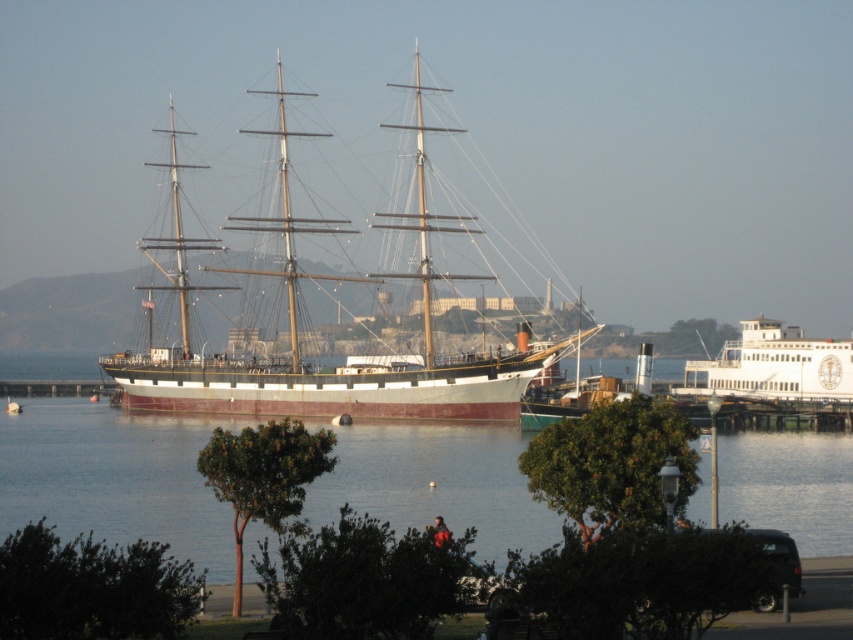
You are standing on the pier next to the historic building and want to take a photo of the rusty metal sailboat at center. If your camera has a maximum zoom range of 100 feet, can you capture the sailboat clearly without moving closer?

The rusty metal sailboat at center and camera are 410.88 feet apart, which exceeds the camera maximum zoom range of 100 feet. Therefore, you cannot capture the sailboat clearly without moving closer.

You are a sailor who wants to board the rusty metal sailboat at center from the pier. The clear water at center is between the pier and the sailboat. Can you step onto the sailboat directly from the pier without getting wet?

The clear water at center has a lesser height compared to the rusty metal sailboat at center, meaning the sailboat is higher than the water. Since the water is lower, you can step onto the sailboat directly from the pier without getting wet as the sailboat is elevated above the water level.

You are a tour guide explaining the vessels in the image. You want to highlight the size difference between the rusty metal sailboat at center and the white glossy ferry at right. How would you describe their sizes in relation to each other?

The rusty metal sailboat at center is wider than the white glossy ferry at right, making it the larger vessel in terms of width between the two.